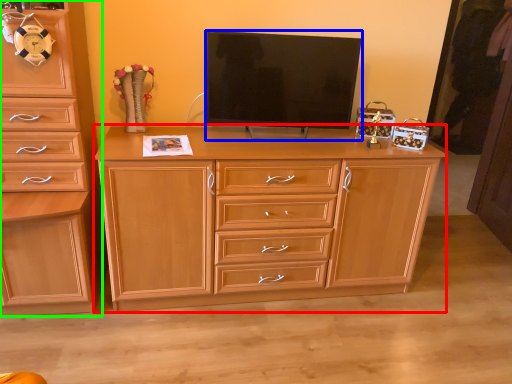
Question: Considering the real-world distances, which object is farthest from chest of drawers (highlighted by a red box)? television (highlighted by a blue box) or chest of drawers (highlighted by a green box)?

Choices:
 (A) television
 (B) chest of drawers

Answer: (B)